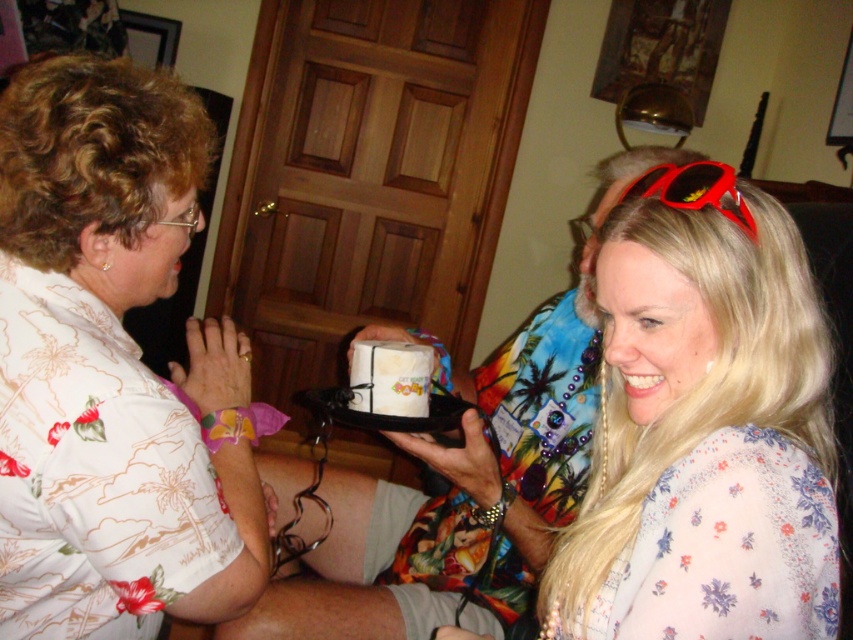
Who is more distant from viewer, (82, 604) or (776, 488)?

The point (82, 604) is more distant.

Which is above, white floral shirt at upper left or floral sheer blouse at center?

white floral shirt at upper left is higher up.

Between point (225, 337) and point (686, 435), which one is positioned in front?

Point (686, 435) is in front.

At what (x,y) coordinates should I click in order to perform the action: click on white floral shirt at upper left. Please return your answer as a coordinate pair (x, y). The height and width of the screenshot is (640, 853). Looking at the image, I should click on (112, 368).

Who is lower down, white floral shirt at upper left or red plastic sunglasses at upper right?

Positioned lower is white floral shirt at upper left.

Who is higher up, white floral shirt at upper left or red plastic sunglasses at upper right?

red plastic sunglasses at upper right is higher up.

The width and height of the screenshot is (853, 640). I want to click on white floral shirt at upper left, so click(x=112, y=368).

This screenshot has height=640, width=853. I want to click on white floral shirt at upper left, so click(x=112, y=368).

Which is below, white floral shirt at upper left or white paper cake at center?

white paper cake at center is below.

Is white floral shirt at upper left shorter than white paper cake at center?

No.

Which is behind, point (178, 237) or point (422, 394)?

Point (422, 394)

Where is `white floral shirt at upper left`? white floral shirt at upper left is located at coordinates (112, 368).